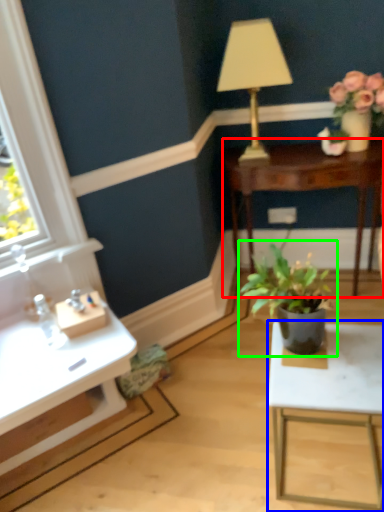
Question: Which object is positioned farthest from table (highlighted by a red box)? Select from table (highlighted by a blue box) and houseplant (highlighted by a green box).

Choices:
 (A) table
 (B) houseplant

Answer: (A)